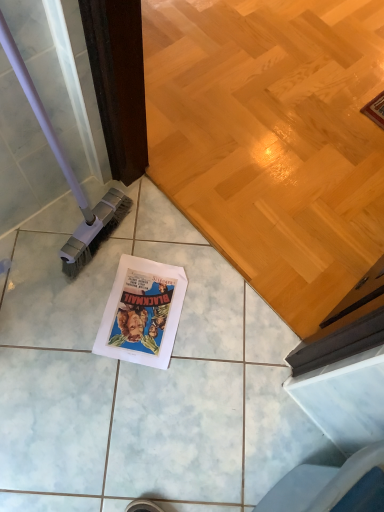
Where is `free space that is in between purple plastic brush at left and white paper comic book at center`? Image resolution: width=384 pixels, height=512 pixels. free space that is in between purple plastic brush at left and white paper comic book at center is located at coordinates (119, 271).